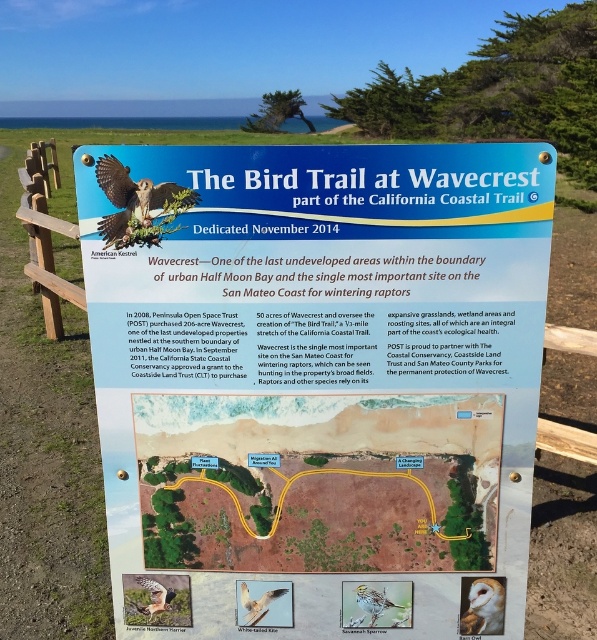
The height and width of the screenshot is (640, 597). What do you see at coordinates (321, 381) in the screenshot? I see `blue plastic sign at center` at bounding box center [321, 381].

Does blue plastic sign at center have a larger size compared to white feathered bird at center?

Yes, blue plastic sign at center is bigger than white feathered bird at center.

Is point (202, 157) in front of point (278, 602)?

Yes.

Identify the location of blue plastic sign at center. pos(321,381).

Can you confirm if blue plastic sign at center is positioned to the right of matte brown eagle at upper left?

Correct, you'll find blue plastic sign at center to the right of matte brown eagle at upper left.

In the scene shown: Can you confirm if blue plastic sign at center is thinner than matte brown eagle at upper left?

Incorrect, blue plastic sign at center's width is not less than matte brown eagle at upper left's.

Who is more forward, (275, 504) or (177, 195)?

Point (177, 195)

Identify the location of blue plastic sign at center. (321, 381).

Who is more distant from viewer, (470, 602) or (150, 611)?

The point (150, 611) is more distant.

Can you confirm if white feathered owl at center is smaller than brown speckled feathers at center?

No, white feathered owl at center is not smaller than brown speckled feathers at center.

Is point (473, 586) behind point (144, 577)?

That is False.

Find the location of a particular element. This screenshot has width=597, height=640. white feathered owl at center is located at coordinates (484, 608).